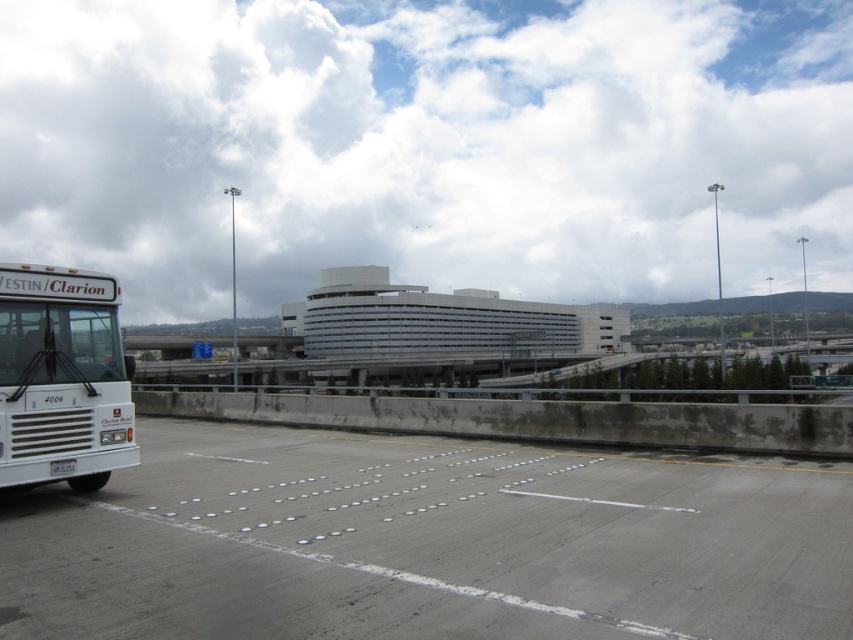
You are driving a car and want to turn onto the gray concrete highway at center from the white matte bus at left. Which direction should you turn?

You should turn right because the gray concrete highway at center is located to the right of the white matte bus at left.